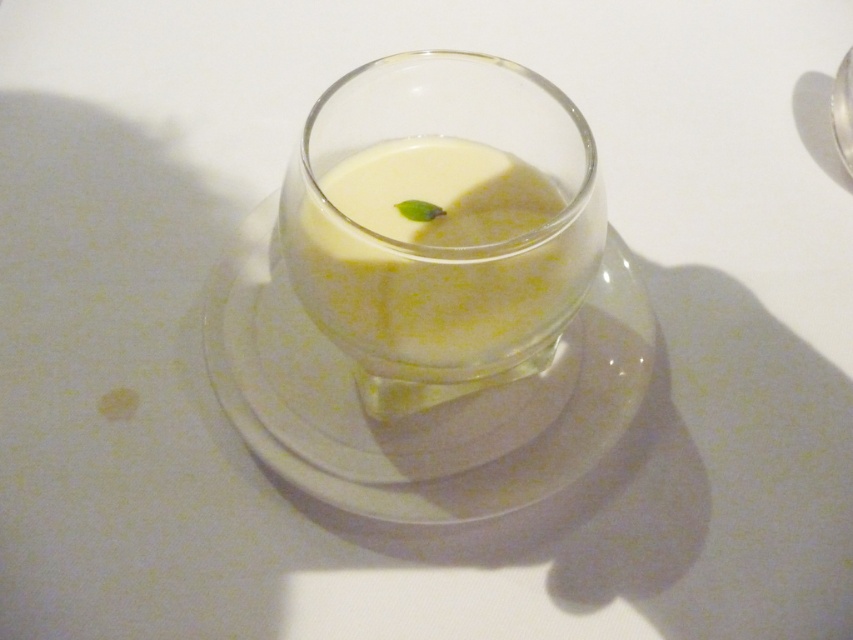
You are a food stylist arranging a dessert display. You have a white glossy plate at center and a white opaque glass at center. If you need to place a small spoon between them, will there be enough space?

The distance between the white glossy plate at center and the white opaque glass at center is 1.43 inches, so there is enough space to place a small spoon between them.

You are a chef preparing to serve a dessert. You have a white glossy plate at center and a white opaque glass at center. Which one should you place the dessert on if you want to highlight its creamy texture?

The white glossy plate at center has a larger size compared to the white opaque glass at center, so placing the dessert on the larger plate will provide a better surface to showcase its creamy texture.